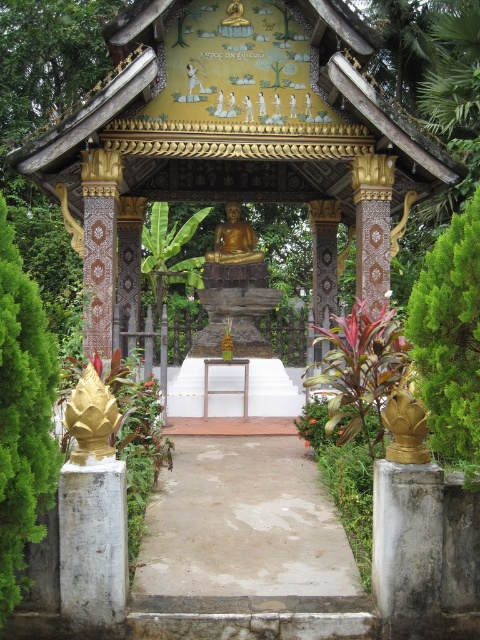
Which is above, gold painted wood gazebo at center or gold polished statue at center?

gold polished statue at center is higher up.

Who is more forward, (113, 186) or (232, 216)?

Positioned in front is point (113, 186).

Which is in front, point (88, 243) or point (228, 227)?

Positioned in front is point (88, 243).

I want to click on gold painted wood gazebo at center, so click(x=236, y=134).

Between point (274, 520) and point (48, 419), which one is positioned behind?

The point (274, 520) is more distant.

How distant is concrete at center from green leafy bush at left?

The distance of concrete at center from green leafy bush at left is 16.36 feet.

Which is in front, point (223, 524) or point (22, 540)?

Point (22, 540) is more forward.

Where is `concrete at center`? Image resolution: width=480 pixels, height=640 pixels. concrete at center is located at coordinates (243, 524).

Is green leafy bush at left behind green leafy bush at right?

No, it is in front of green leafy bush at right.

Can you confirm if green leafy bush at left is smaller than green leafy bush at right?

Indeed, green leafy bush at left has a smaller size compared to green leafy bush at right.

This screenshot has height=640, width=480. Identify the location of green leafy bush at left. [23, 417].

The width and height of the screenshot is (480, 640). I want to click on green leafy bush at left, so click(23, 417).